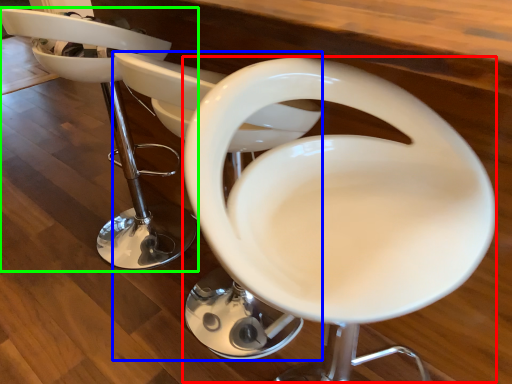
Question: Estimate the real-world distances between objects in this image. Which object is farther from feeding chair (highlighted by a red box), feeding chair (highlighted by a blue box) or chair (highlighted by a green box)?

Choices:
 (A) feeding chair
 (B) chair

Answer: (B)